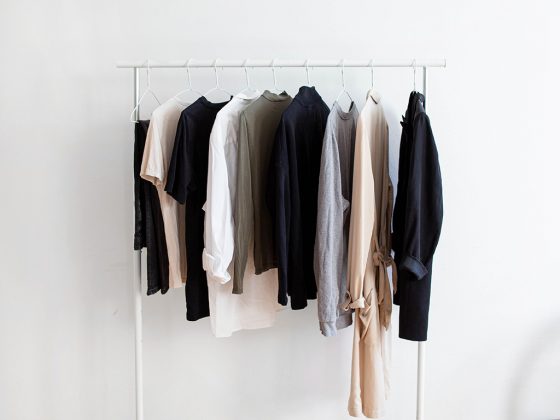
The height and width of the screenshot is (420, 560). In order to click on hanger in this screenshot , I will do `click(148, 79)`, `click(186, 79)`, `click(216, 75)`, `click(248, 79)`, `click(276, 79)`, `click(308, 77)`, `click(342, 77)`, `click(372, 78)`, `click(415, 79)`.